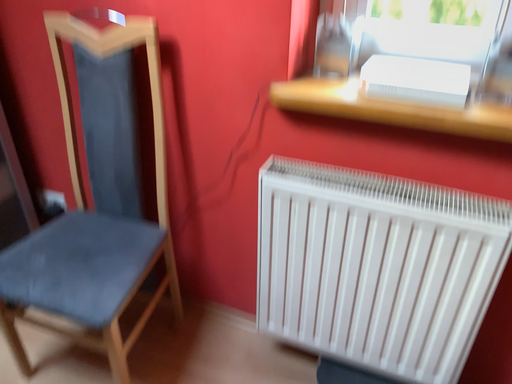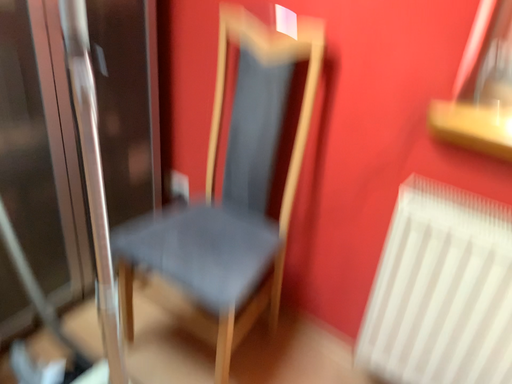
Question: How did the camera likely rotate when shooting the video?

Choices:
 (A) rotated left
 (B) rotated right

Answer: (A)